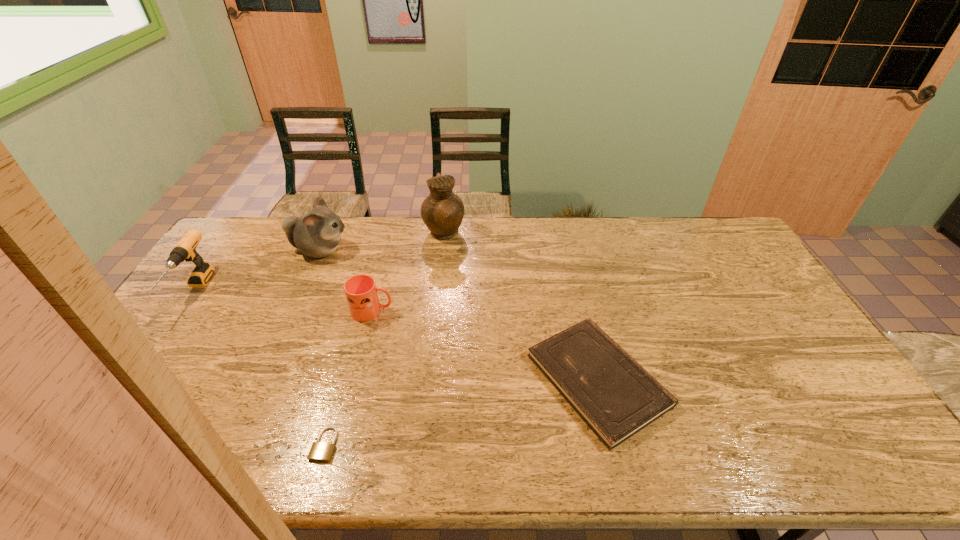
You are a GUI agent. You are given a task and a screenshot of the screen. Output one action in this format:
    pyautogui.click(x=<x>, y=<y>)
    Task: Click on the blank area located at the spout of the second object from right to left
    This screenshot has width=960, height=540.
    Given the screenshot: What is the action you would take?
    pyautogui.click(x=520, y=234)

You are a GUI agent. You are given a task and a screenshot of the screen. Output one action in this format:
    pyautogui.click(x=<x>, y=<y>)
    Task: Click on the vacant space situated 0.270m on the face of the fifth shortest object
    The height and width of the screenshot is (540, 960).
    Given the screenshot: What is the action you would take?
    pyautogui.click(x=424, y=251)

Locate an element on the screen. vacant space located 0.400m on the handle side of the drill is located at coordinates (86, 447).

This screenshot has height=540, width=960. I want to click on vacant space located 0.050m on the handle side of the mug, so click(x=410, y=311).

At what (x,y) coordinates should I click in order to perform the action: click on vacant space located on the back of the second shortest object. Please return your answer as a coordinate pair (x, y). Looking at the image, I should click on (566, 245).

What are the coordinates of `vacant space situated on the right of the shortest object` in the screenshot? It's located at [366, 444].

What are the coordinates of `pitcher present at the far edge` in the screenshot? It's located at (442, 212).

This screenshot has width=960, height=540. Identify the location of hamster present at the far edge. (317, 233).

At what (x,y) coordinates should I click in order to perform the action: click on paperback book situated at the near edge. Please return your answer as a coordinate pair (x, y). The image size is (960, 540). Looking at the image, I should click on (616, 397).

Where is `padlock at the near edge`? padlock at the near edge is located at coordinates (320, 451).